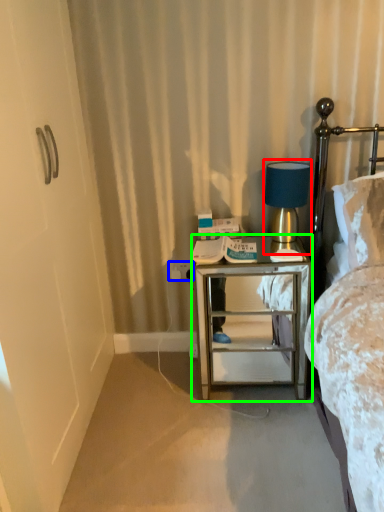
Question: Estimate the real-world distances between objects in this image. Which object is farther from table lamp (highlighted by a red box), electric outlet (highlighted by a blue box) or nightstand (highlighted by a green box)?

Choices:
 (A) electric outlet
 (B) nightstand

Answer: (A)